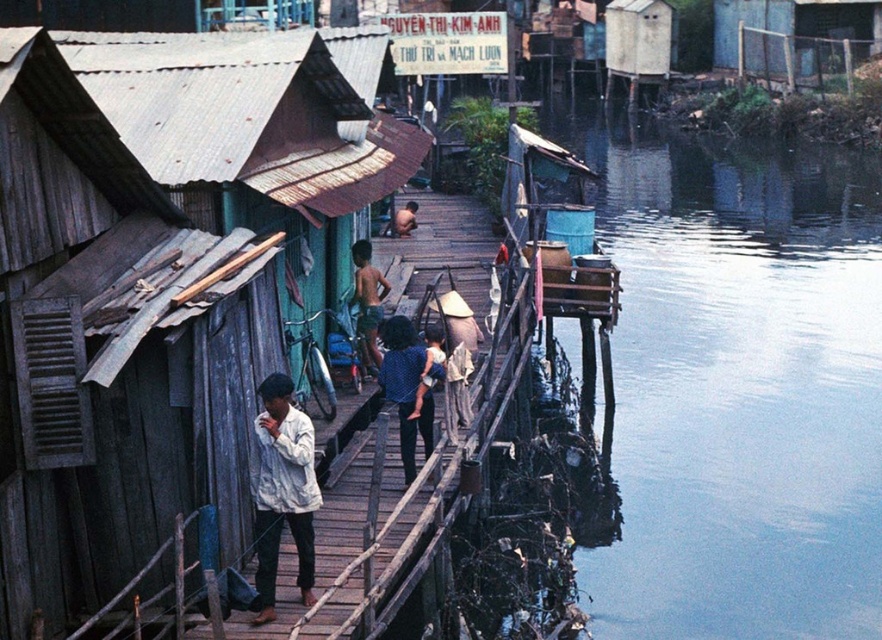
Looking at this image, is blue dotted shirt at center bigger than light brown skin at center?

Yes.

Is blue dotted shirt at center shorter than light brown skin at center?

In fact, blue dotted shirt at center may be taller than light brown skin at center.

Between point (413, 458) and point (412, 200), which one is positioned behind?

The point (412, 200) is more distant.

Where is `blue dotted shirt at center`? The image size is (882, 640). blue dotted shirt at center is located at coordinates (406, 388).

Is rusty corrugated metal hut at center to the left of light brown shorts at center from the viewer's perspective?

Indeed, rusty corrugated metal hut at center is positioned on the left side of light brown shorts at center.

Can you confirm if rusty corrugated metal hut at center is wider than light brown shorts at center?

Yes, rusty corrugated metal hut at center is wider than light brown shorts at center.

Where is `rusty corrugated metal hut at center`? rusty corrugated metal hut at center is located at coordinates (158, 284).

You are a GUI agent. You are given a task and a screenshot of the screen. Output one action in this format:
    pyautogui.click(x=<x>, y=<y>)
    Task: Click on the rusty corrugated metal hut at center
    This screenshot has height=640, width=882.
    Given the screenshot: What is the action you would take?
    pyautogui.click(x=158, y=284)

Can you confirm if white cotton shirt at center is bigger than light brown shorts at center?

Correct, white cotton shirt at center is larger in size than light brown shorts at center.

This screenshot has width=882, height=640. What are the coordinates of `white cotton shirt at center` in the screenshot? It's located at (283, 492).